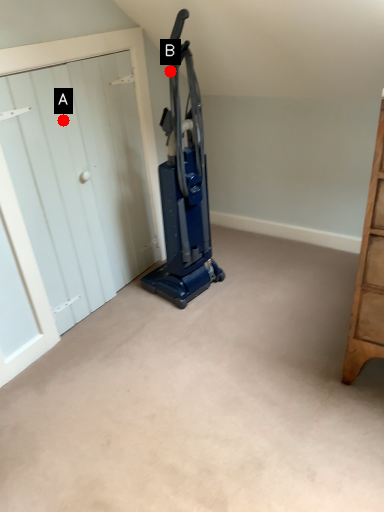
Question: Two points are circled on the image, labeled by A and B beside each circle. Which point is closer to the camera?

Choices:
 (A) A is closer
 (B) B is closer

Answer: (A)